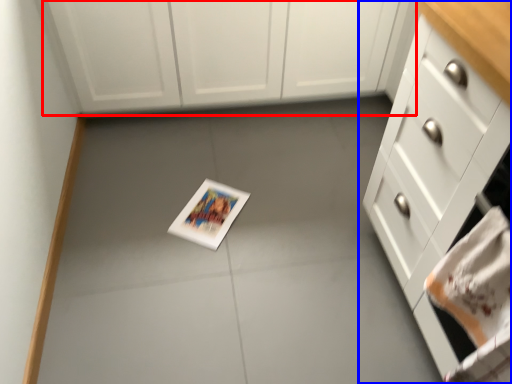
Question: Among these objects, which one is farthest to the camera, cabinetry (highlighted by a red box) or cabinetry (highlighted by a blue box)?

Choices:
 (A) cabinetry
 (B) cabinetry

Answer: (A)